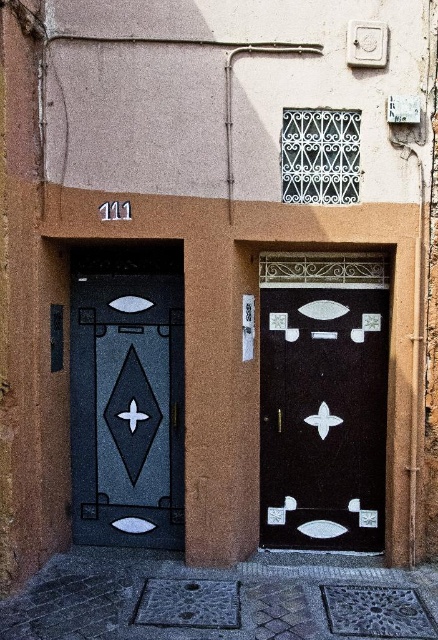
You are standing at the point marked by the coordinates point [219,598] on the smooth stone pavement at lower center. Which direction should you walk to reach the left door with the diamond design?

The smooth stone pavement at lower center is represented by point [219,598]. To reach the left door with the diamond design, you should walk towards the left door, as it is positioned to the left side of the image relative to the pavement point.

From the picture: You are standing on the smooth stone pavement at lower center and want to reach the matte black door at center. Is the path clear of any large obstacles between them?

The smooth stone pavement at lower center is bigger than matte black door at center, but the description does not mention any obstacles between them. Therefore, the path is likely clear.